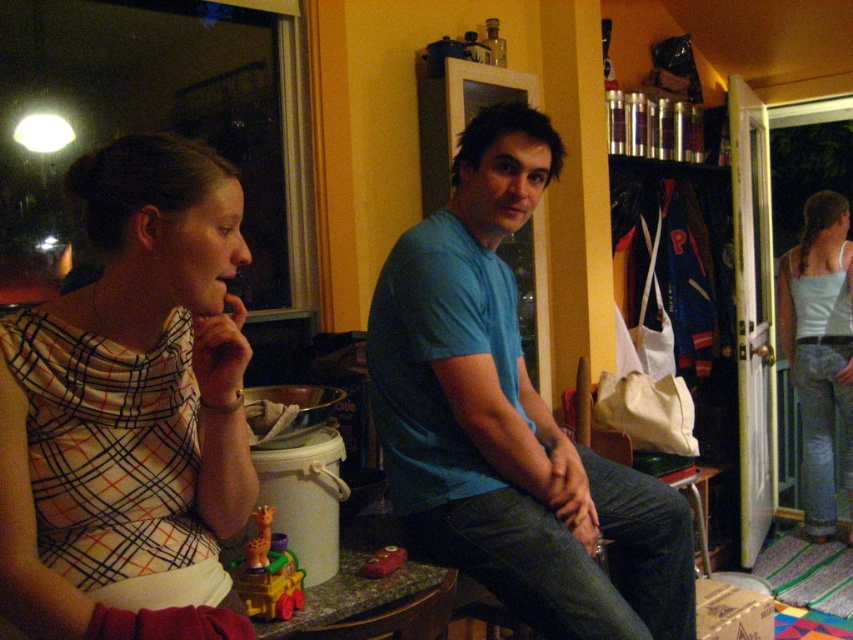
Question: Which point appears closest to the camera in this image?

Choices:
 (A) (373, 561)
 (B) (241, 588)
 (C) (827, 209)
 (D) (178, 467)

Answer: (D)

Question: In this image, where is plaid fabric dress at left located relative to rubber yellow train at center?

Choices:
 (A) above
 (B) below

Answer: (A)

Question: Which of these objects is positioned farthest from the light blue tank top at right?

Choices:
 (A) matte blue shirt at center
 (B) rubber yellow train at center
 (C) plaid fabric dress at left

Answer: (C)

Question: In this image, where is light blue tank top at right located relative to rubber yellow train at center?

Choices:
 (A) above
 (B) below

Answer: (A)

Question: From the image, what is the correct spatial relationship of blue cotton shirt at center in relation to rubberized red toy car at center?

Choices:
 (A) above
 (B) below

Answer: (A)

Question: Which object appears farthest from the camera in this image?

Choices:
 (A) rubber yellow train at center
 (B) light blue tank top at right
 (C) matte blue shirt at center

Answer: (B)